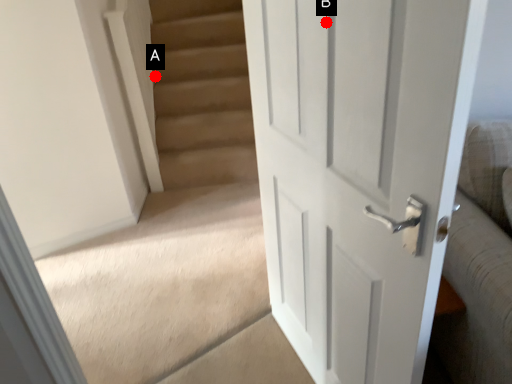
Question: Two points are circled on the image, labeled by A and B beside each circle. Which of the following is the farthest from the observer?

Choices:
 (A) A is further
 (B) B is further

Answer: (A)